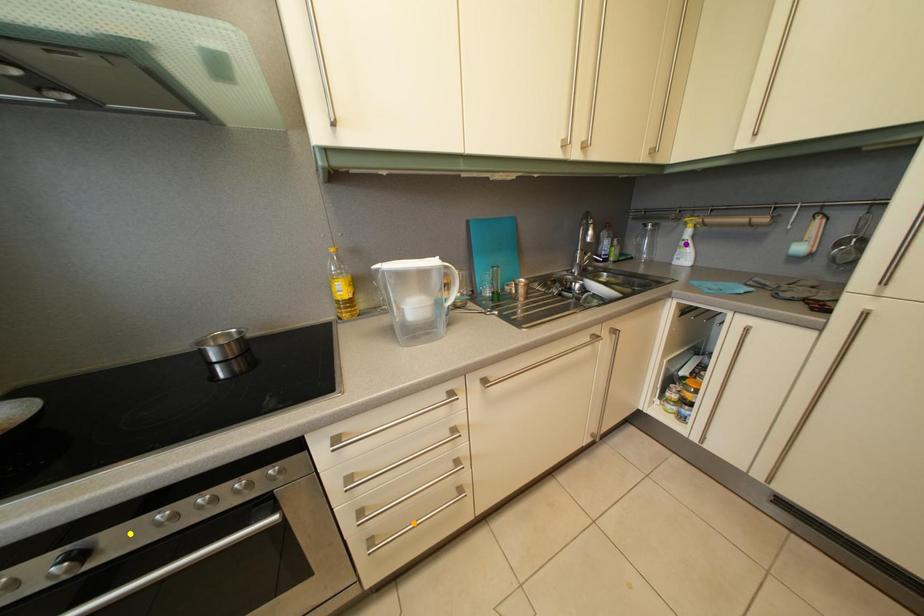
Order these from farthest to nearest:
purple point | orange point | yellow point

purple point < orange point < yellow point